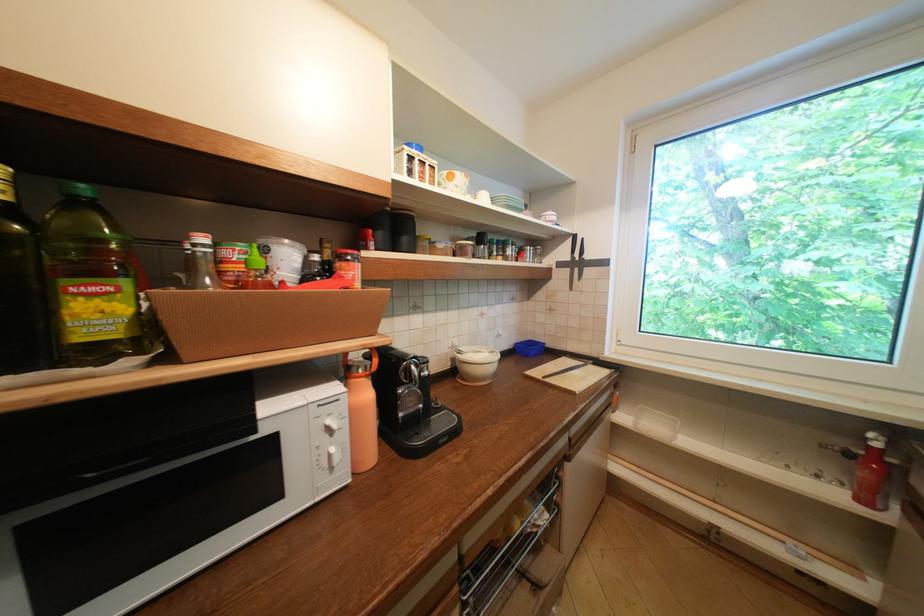
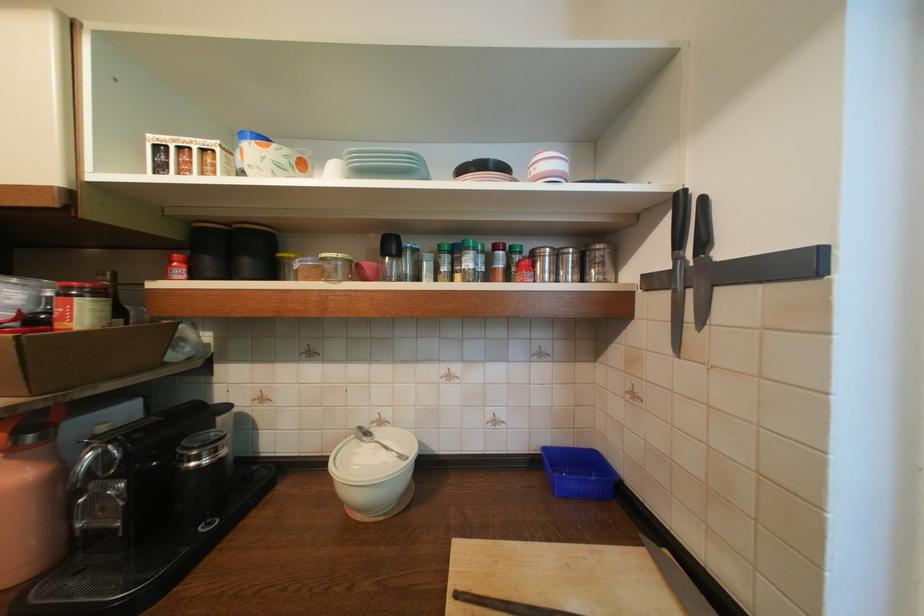
Locate, in the second image, the point that corresponds to (x=375, y=249) in the first image.

(174, 278)